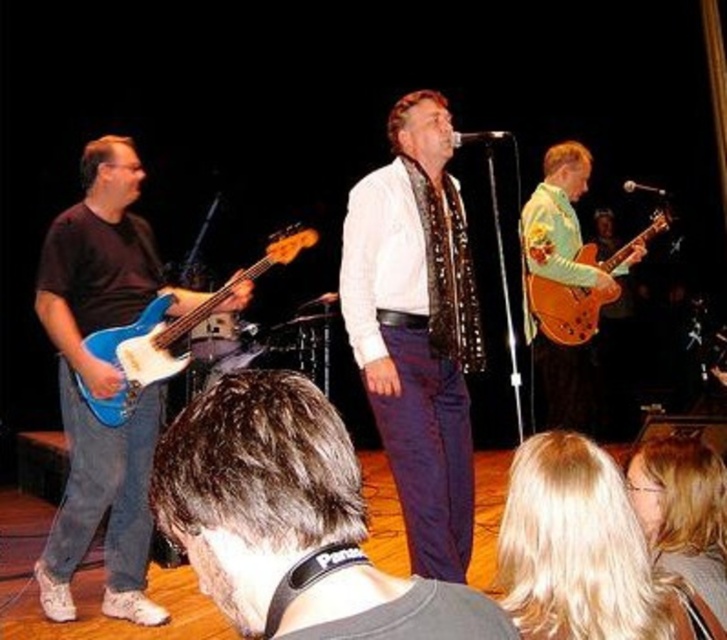
Which of these two, blonde hair at upper center or blue matte electric guitar at left, stands shorter?

With less height is blonde hair at upper center.

Who is taller, blonde hair at upper center or blue matte electric guitar at left?

Standing taller between the two is blue matte electric guitar at left.

Which is in front, point (699, 540) or point (104, 328)?

Point (699, 540) is in front.

Identify the location of blonde hair at upper center. (683, 513).

Does dark brown hair at center appear on the right side of blue matte electric guitar at left?

Correct, you'll find dark brown hair at center to the right of blue matte electric guitar at left.

In the scene shown: Measure the distance between point (220,384) and camera.

They are 34.15 inches apart.

Who is more forward, (510, 632) or (156, 326)?

Positioned in front is point (510, 632).

Identify the location of dark brown hair at center. This screenshot has width=727, height=640. (292, 522).

Does blue matte electric guitar at left appear on the left side of glossy wood guitar at right?

Yes, blue matte electric guitar at left is to the left of glossy wood guitar at right.

This screenshot has height=640, width=727. What are the coordinates of `blue matte electric guitar at left` in the screenshot? It's located at (169, 332).